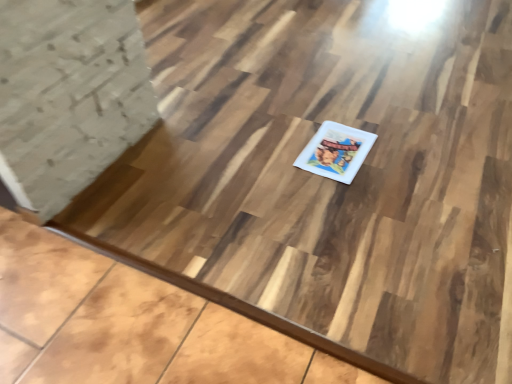
Locate an element on the screen. This screenshot has width=512, height=384. free area behind white glossy book at center is located at coordinates tap(325, 112).